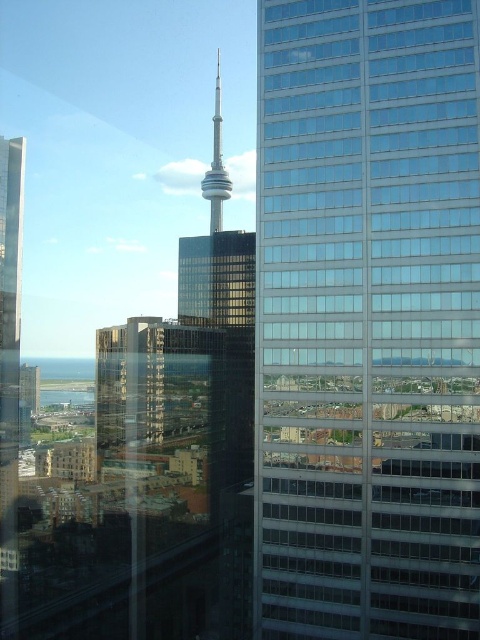
You are a drone operator trying to navigate between buildings in the city. You need to fly your drone from the glassy reflective skyscraper at center to the cylindrical tower structure in the midground. Based on their positions, which direction should you fly the drone to reach the cylindrical tower structure?

The glassy reflective skyscraper at center is located at point [367,321], so to reach the cylindrical tower structure, you should fly the drone in the direction of the midground where the cylindrical tower is positioned, which is likely further away from the center towards the background compared to the skyscraper.

You are standing 200 feet away from a glassy reflective skyscraper at center. Can you safely approach it within 10 feet without violating the safety zone?

The glassy reflective skyscraper at center is 197.68 feet away from the viewer. Since you are already 200 feet away, approaching it within 10 feet would bring you to 197.68 feet, which is within the safety zone. However, the exact safety distance requirements depend on local regulations, so ensure compliance.

You are an architect analyzing the city layout. You see the glassy reflective skyscraper at center and the shiny glass tower at center. Which one is positioned to the right in the scene?

The glassy reflective skyscraper at center is positioned to the right of the shiny glass tower at center.